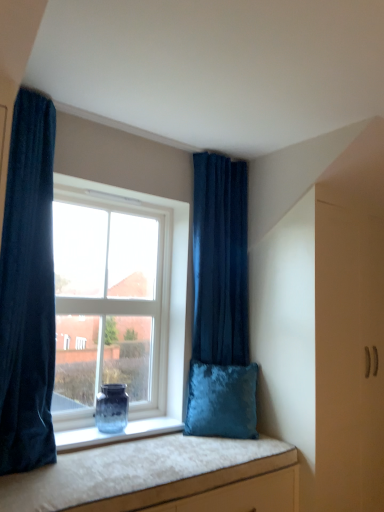
Locate an element on the screen. This screenshot has width=384, height=512. free area in between velvet dark blue curtain at left, positioned as the 1th curtain in front-to-back order, and velvet dark blue curtain at upper center, the first curtain viewed from the back is located at coordinates (132, 449).